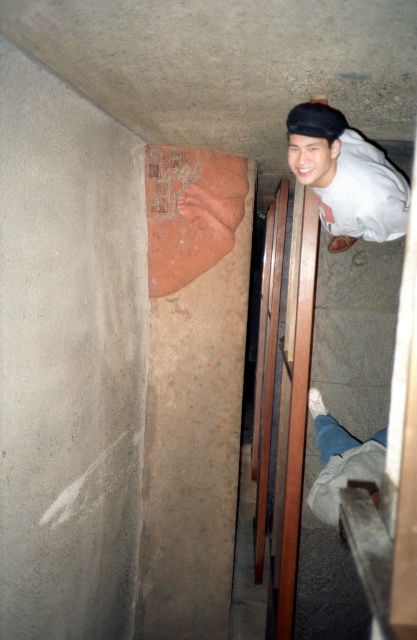
Looking at this image, you are standing in the basement and want to move from the point marked as point (296, 160) to the point marked as point (314, 429). Is the path between these two points clear of any obstacles?

The path between point (296, 160) and point (314, 429) is clear because point (296, 160) is in front of point (314, 429), indicating no obstacles block the way.

You are a fashion designer observing the image. You need to determine which item has a greater horizontal span between the white cotton pants at lower right and the black matte baseball hat at upper center. Which one is wider?

The white cotton pants at lower right are wider than the black matte baseball hat at upper center because the white cotton pants at lower right has a greater width as stated in the description.

You are a security camera in this dimly lit space. You observe the white matte shirt at upper right and the white cotton pants at lower right. Which of these two items is positioned closer to the left side of the space?

The white matte shirt at upper right is positioned closer to the left side of the space than the white cotton pants at lower right.